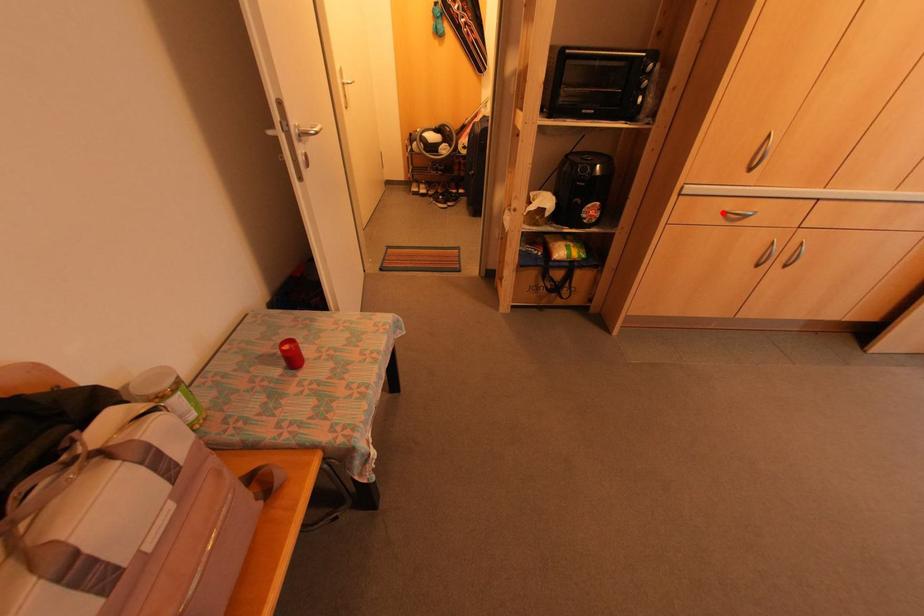
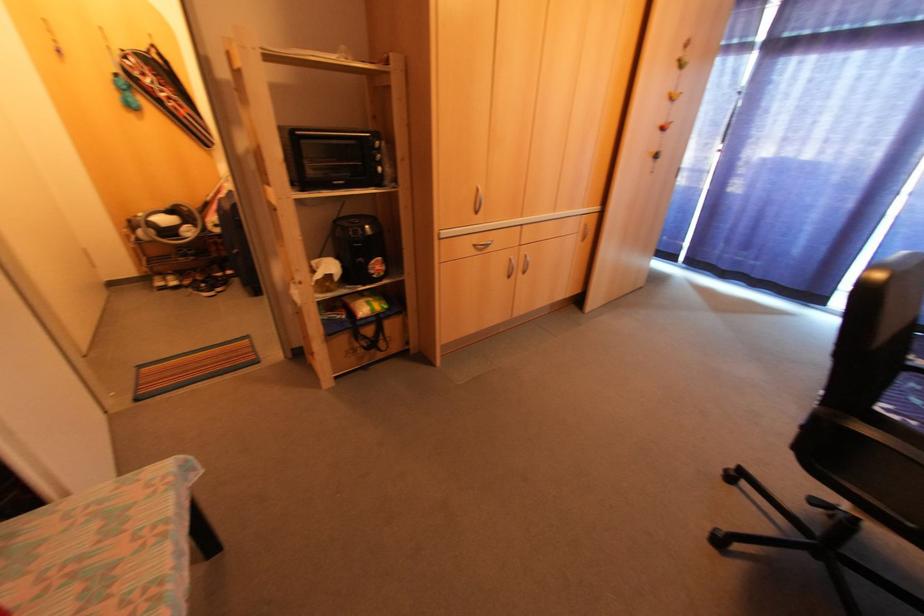
Question: I am providing you with two images of the same scene from different viewpoints. A red point is marked on the first image. Is the red point's position out of view in image 2?

Choices:
 (A) Yes
 (B) No

Answer: (B)